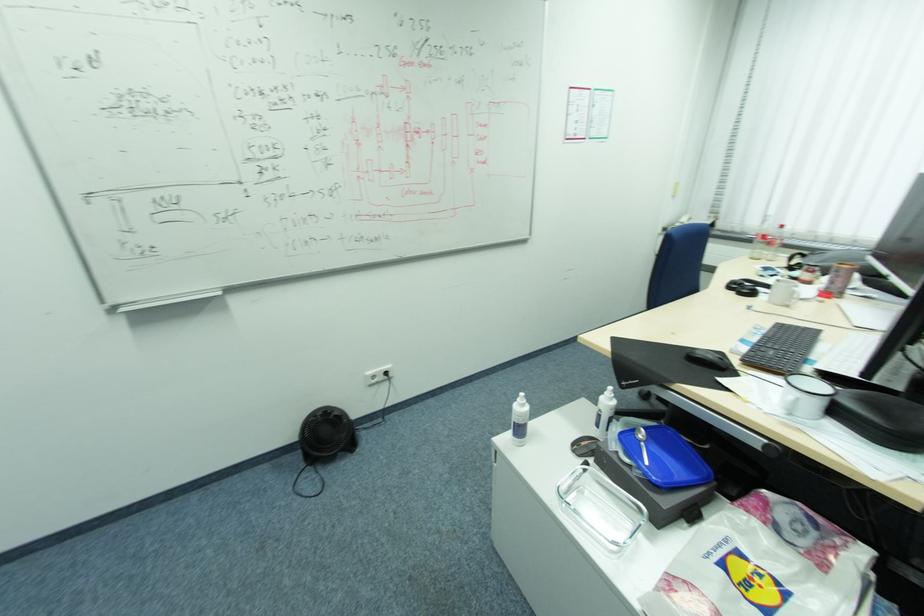
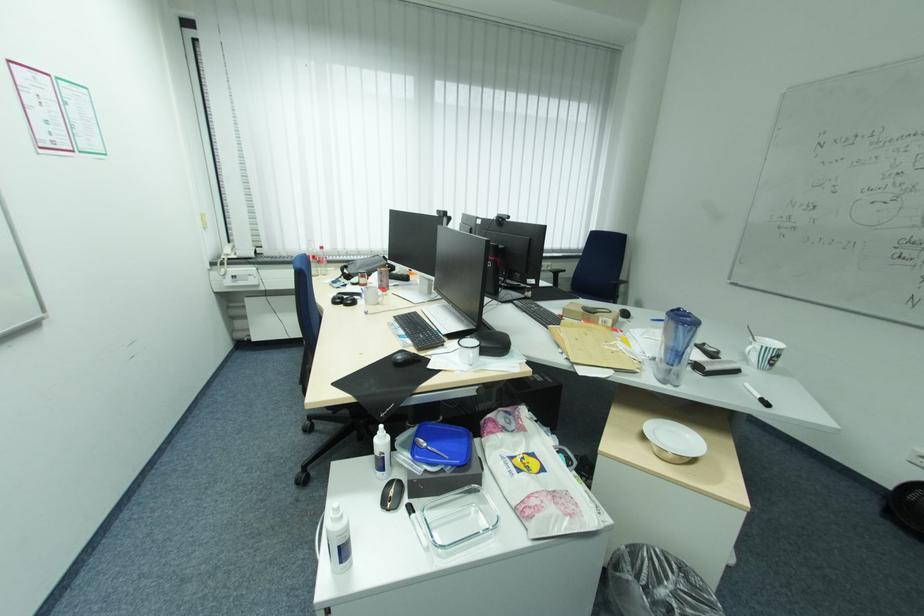
Find the pixel in the second image that matches (x=699, y=355) in the first image.

(406, 361)